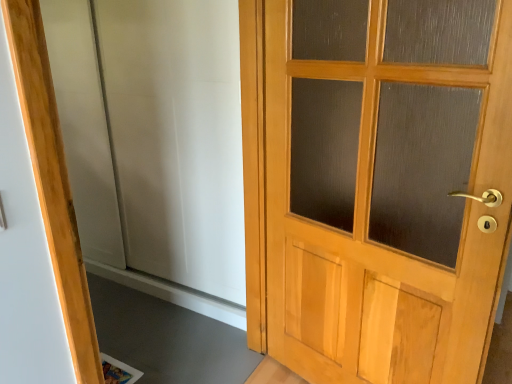
Question: From the image's perspective, is white matte elevator at center located above or below light wood/glass door at right?

Choices:
 (A) above
 (B) below

Answer: (A)

Question: From a real-world perspective, is white matte elevator at center positioned above or below light wood/glass door at right?

Choices:
 (A) above
 (B) below

Answer: (A)

Question: Is white matte elevator at center bigger or smaller than light wood/glass door at right?

Choices:
 (A) small
 (B) big

Answer: (B)

Question: Based on their positions, is light wood/glass door at right located to the left or right of white matte elevator at center?

Choices:
 (A) right
 (B) left

Answer: (A)

Question: From a real-world perspective, relative to white matte elevator at center, is light wood/glass door at right vertically above or below?

Choices:
 (A) above
 (B) below

Answer: (B)

Question: From the image's perspective, is light wood/glass door at right above or below white matte elevator at center?

Choices:
 (A) above
 (B) below

Answer: (B)

Question: In terms of height, does light wood/glass door at right look taller or shorter compared to white matte elevator at center?

Choices:
 (A) short
 (B) tall

Answer: (A)